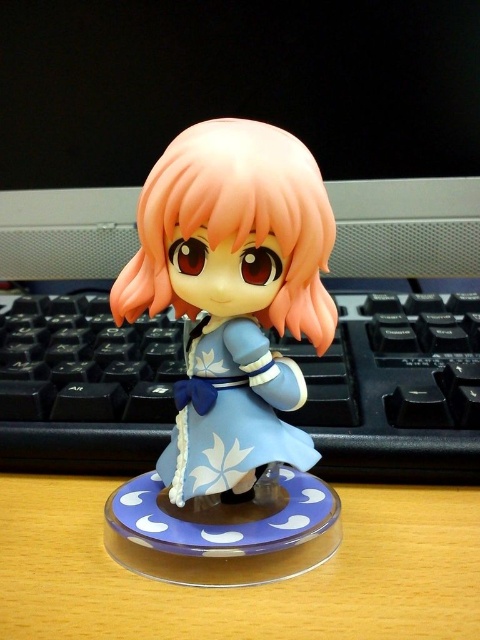
You are setting up a desk display and want to place the matte blue figurine at center and the black plastic keyboard at center. Since you want the figurine to be the focal point, which object should you position closer to the front of the desk to make it appear larger?

To make the matte blue figurine at center appear larger as the focal point, position it closer to the front of the desk since it has a smaller size compared to the black plastic keyboard at center.

You are setting up a desk and want to place the matte blue figurine at center and the black plastic keyboard at center so that the figurine is visible from the front. Since both are at center, how can you arrange them to ensure the figurine isn

The matte blue figurine at center is closer to the viewer than the black plastic keyboard at center, so placing the figurine in front of the keyboard will ensure it remains visible from the front.